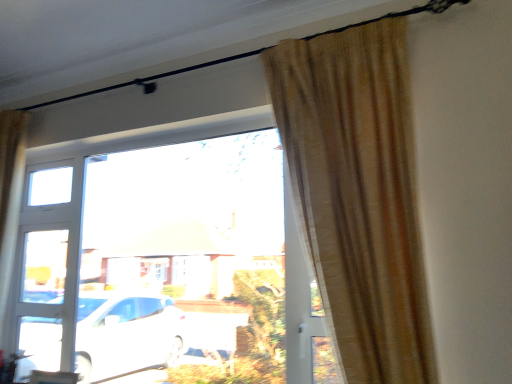
At what (x,y) coordinates should I click in order to perform the action: click on transparent glass window at center. Please return your answer as a coordinate pair (x, y). The height and width of the screenshot is (384, 512). Looking at the image, I should click on (163, 251).

Describe the element at coordinates (163, 251) in the screenshot. The width and height of the screenshot is (512, 384). I see `transparent glass window at center` at that location.

Image resolution: width=512 pixels, height=384 pixels. What do you see at coordinates (358, 193) in the screenshot? I see `beige textured curtain at right` at bounding box center [358, 193].

What is the approximate width of beige textured curtain at right?

beige textured curtain at right is 16.72 inches wide.

The width and height of the screenshot is (512, 384). Identify the location of beige textured curtain at right. (x=358, y=193).

Where is `transparent glass window at center`? This screenshot has height=384, width=512. transparent glass window at center is located at coordinates (163, 251).

Which object is positioned more to the left, beige textured curtain at right or transparent glass window at center?

transparent glass window at center is more to the left.

Is beige textured curtain at right further to the viewer compared to transparent glass window at center?

A: That is False.

Which is less distant, (272, 81) or (193, 175)?

Point (272, 81) is closer to the camera than point (193, 175).

From the image's perspective, which is above, beige textured curtain at right or transparent glass window at center?

beige textured curtain at right is shown above in the image.

From a real-world perspective, does beige textured curtain at right stand above transparent glass window at center?

Indeed, from a real-world perspective, beige textured curtain at right stands above transparent glass window at center.

Looking at their sizes, would you say beige textured curtain at right is wider or thinner than transparent glass window at center?

In the image, beige textured curtain at right appears to be wider than transparent glass window at center.

Can you confirm if beige textured curtain at right is shorter than transparent glass window at center?

Indeed, beige textured curtain at right has a lesser height compared to transparent glass window at center.

Does beige textured curtain at right have a smaller size compared to transparent glass window at center?

Actually, beige textured curtain at right might be larger than transparent glass window at center.

Is transparent glass window at center a part of beige textured curtain at right?

No, beige textured curtain at right does not contain transparent glass window at center.

Are beige textured curtain at right and transparent glass window at center far apart?

They are positioned close to each other.

Is beige textured curtain at right oriented towards transparent glass window at center?

No, beige textured curtain at right is not facing towards transparent glass window at center.

How many degrees apart are the facing directions of beige textured curtain at right and transparent glass window at center?

0.48 degrees separate the facing orientations of beige textured curtain at right and transparent glass window at center.

Locate an element on the screen. This screenshot has width=512, height=384. curtain lying on the right of transparent glass window at center is located at coordinates (358, 193).

Based on their positions, is transparent glass window at center located to the left or right of beige textured curtain at right?

transparent glass window at center is to the left of beige textured curtain at right.

Is the depth of transparent glass window at center less than that of beige textured curtain at right?

No, it is not.

Is point (175, 302) positioned before point (412, 186)?

That is False.

From the image's perspective, is transparent glass window at center below beige textured curtain at right?

Indeed, from the image's perspective, transparent glass window at center is shown beneath beige textured curtain at right.

From a real-world perspective, relative to beige textured curtain at right, is transparent glass window at center vertically above or below?

transparent glass window at center is situated lower than beige textured curtain at right in the real world.

Between transparent glass window at center and beige textured curtain at right, which one has smaller width?

transparent glass window at center is thinner.

In the scene shown: Which of these two, transparent glass window at center or beige textured curtain at right, stands shorter?

Standing shorter between the two is beige textured curtain at right.

Can you confirm if transparent glass window at center is bigger than beige textured curtain at right?

Incorrect, transparent glass window at center is not larger than beige textured curtain at right.

Is transparent glass window at center not inside beige textured curtain at right?

That's correct, transparent glass window at center is outside of beige textured curtain at right.

Would you say transparent glass window at center is a long distance from beige textured curtain at right?

No, there isn't a large distance between transparent glass window at center and beige textured curtain at right.

Is transparent glass window at center facing towards beige textured curtain at right?

No, transparent glass window at center is not turned towards beige textured curtain at right.

Measure the distance between transparent glass window at center and beige textured curtain at right.

They are 99.06 centimeters apart.

At what (x,y) coordinates should I click in order to perform the action: click on curtain in front of the transparent glass window at center. Please return your answer as a coordinate pair (x, y). The image size is (512, 384). Looking at the image, I should click on (358, 193).

Image resolution: width=512 pixels, height=384 pixels. What are the coordinates of `window behind the beige textured curtain at right` in the screenshot? It's located at (163, 251).

In order to click on window below the beige textured curtain at right (from the image's perspective) in this screenshot , I will do `click(163, 251)`.